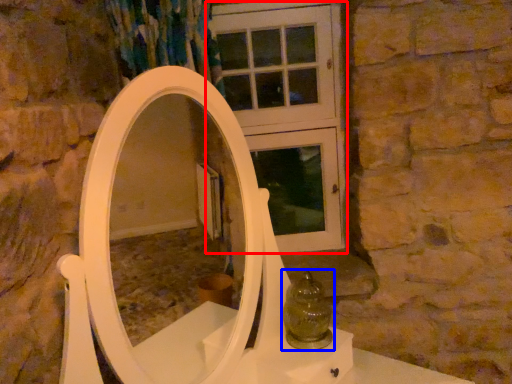
Question: Among these objects, which one is farthest to the camera, screen door (highlighted by a red box) or glass vase (highlighted by a blue box)?

Choices:
 (A) screen door
 (B) glass vase

Answer: (A)